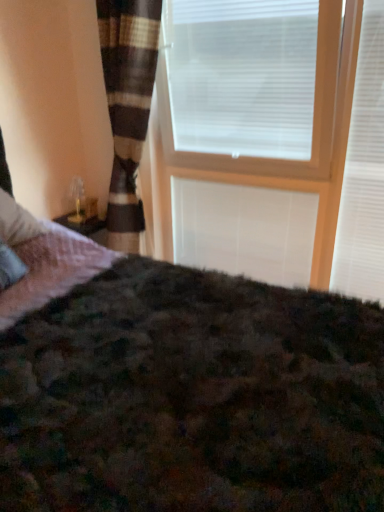
Question: Is wooden frame at upper center closer to camera compared to white matte window blind at upper right, placed as the first window blind when sorted from right to left?

Choices:
 (A) yes
 (B) no

Answer: (A)

Question: Is wooden frame at upper center oriented away from white matte window blind at upper right, which ranks as the 2th window blind in left-to-right order?

Choices:
 (A) no
 (B) yes

Answer: (B)

Question: Is wooden frame at upper center to the left of white matte window blind at upper right, placed as the first window blind when sorted from right to left, from the viewer's perspective?

Choices:
 (A) no
 (B) yes

Answer: (B)

Question: Are wooden frame at upper center and white matte window blind at upper right, which ranks as the 2th window blind in left-to-right order, making contact?

Choices:
 (A) no
 (B) yes

Answer: (A)

Question: From the image's perspective, is wooden frame at upper center on top of white matte window blind at upper right, which ranks as the 2th window blind in left-to-right order?

Choices:
 (A) no
 (B) yes

Answer: (B)

Question: Is point (238, 271) positioned closer to the camera than point (195, 68)?

Choices:
 (A) farther
 (B) closer

Answer: (A)

Question: In the image, is white matte blind at center positioned in front of or behind white plastic blinds at upper center, which is the first window blind from left to right?

Choices:
 (A) behind
 (B) front

Answer: (A)

Question: Considering the positions of white matte blind at center and white plastic blinds at upper center, the 2th window blind viewed from the right, in the image, is white matte blind at center taller or shorter than white plastic blinds at upper center, the 2th window blind viewed from the right,?

Choices:
 (A) tall
 (B) short

Answer: (B)

Question: In terms of width, does white matte blind at center look wider or thinner when compared to white plastic blinds at upper center, the 2th window blind viewed from the right?

Choices:
 (A) wide
 (B) thin

Answer: (B)

Question: From the image's perspective, relative to white matte blind at center, is wooden frame at upper center above or below?

Choices:
 (A) above
 (B) below

Answer: (A)

Question: Is wooden frame at upper center inside the boundaries of white matte blind at center, or outside?

Choices:
 (A) outside
 (B) inside

Answer: (A)

Question: Considering the positions of wooden frame at upper center and white matte blind at center in the image, is wooden frame at upper center taller or shorter than white matte blind at center?

Choices:
 (A) short
 (B) tall

Answer: (B)

Question: In the image, is wooden frame at upper center on the left side or the right side of white matte blind at center?

Choices:
 (A) right
 (B) left

Answer: (A)

Question: From the image's perspective, relative to white matte blind at center, is white matte window blind at upper right, placed as the first window blind when sorted from right to left, above or below?

Choices:
 (A) above
 (B) below

Answer: (A)

Question: Relative to white matte blind at center, is white matte window blind at upper right, placed as the first window blind when sorted from right to left, in front or behind?

Choices:
 (A) behind
 (B) front

Answer: (B)